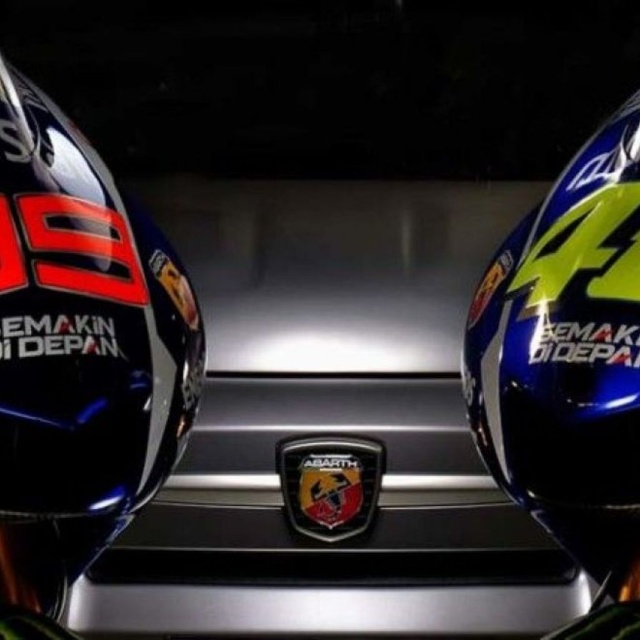
Is point (49, 577) positioned before point (529, 292)?

No, it is behind (529, 292).

Who is more forward, (x=28, y=376) or (x=541, y=408)?

Point (x=28, y=376) is more forward.

This screenshot has height=640, width=640. What are the coordinates of `glossy black helmet at left` in the screenshot? It's located at (81, 352).